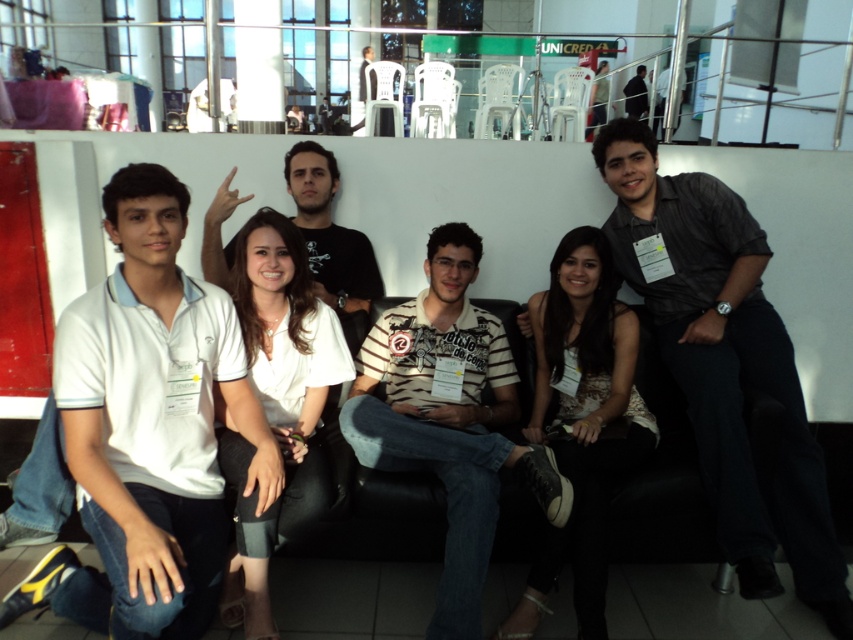
Can you confirm if white cotton polo shirt at left is positioned to the right of black shirt at upper center?

No, white cotton polo shirt at left is not to the right of black shirt at upper center.

Who is taller, white cotton polo shirt at left or black shirt at upper center?

Standing taller between the two is white cotton polo shirt at left.

Where is `white cotton polo shirt at left`? Image resolution: width=853 pixels, height=640 pixels. white cotton polo shirt at left is located at coordinates (149, 426).

What do you see at coordinates (331, 241) in the screenshot? I see `black t-shirt at center` at bounding box center [331, 241].

You are a GUI agent. You are given a task and a screenshot of the screen. Output one action in this format:
    pyautogui.click(x=<x>, y=<y>)
    Task: Click on the black t-shirt at center
    The image size is (853, 640).
    Given the screenshot: What is the action you would take?
    pyautogui.click(x=331, y=241)

How much distance is there between white cotton polo shirt at left and dark gray shirt at center?

white cotton polo shirt at left and dark gray shirt at center are 5.28 feet apart.

Does white cotton polo shirt at left have a lesser width compared to dark gray shirt at center?

Correct, white cotton polo shirt at left's width is less than dark gray shirt at center's.

Identify the location of white cotton polo shirt at left. point(149,426).

Identify the location of white cotton polo shirt at left. (149, 426).